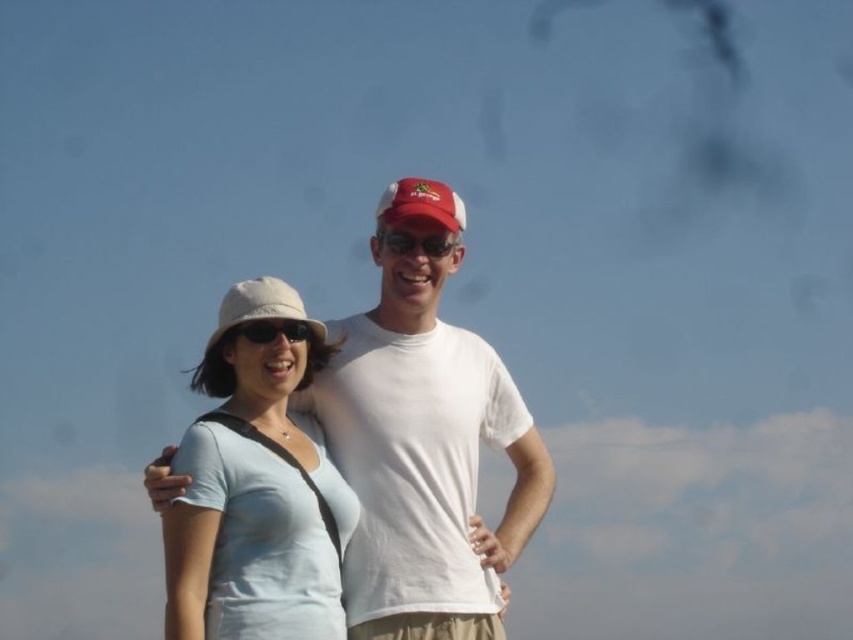
Is point (258, 284) positioned in front of point (407, 237)?

Yes, it is.

Who is higher up, beige fabric baseball hat at center or matte plastic sunglasses at center?

matte plastic sunglasses at center is above.

The height and width of the screenshot is (640, 853). I want to click on beige fabric baseball hat at center, so click(x=260, y=307).

Locate an element on the screen. The width and height of the screenshot is (853, 640). beige fabric baseball hat at center is located at coordinates (260, 307).

Between light blue fabric shirt at center and matte red baseball cap at center, which one is positioned lower?

Positioned lower is light blue fabric shirt at center.

Does light blue fabric shirt at center have a lesser width compared to matte red baseball cap at center?

In fact, light blue fabric shirt at center might be wider than matte red baseball cap at center.

This screenshot has height=640, width=853. Identify the location of light blue fabric shirt at center. (247, 547).

Between beige fabric baseball hat at center and matte red baseball cap at center, which one appears on the right side from the viewer's perspective?

matte red baseball cap at center

Is point (239, 282) behind point (408, 182)?

Yes, it is.

Where is `beige fabric baseball hat at center`? The height and width of the screenshot is (640, 853). beige fabric baseball hat at center is located at coordinates (260, 307).